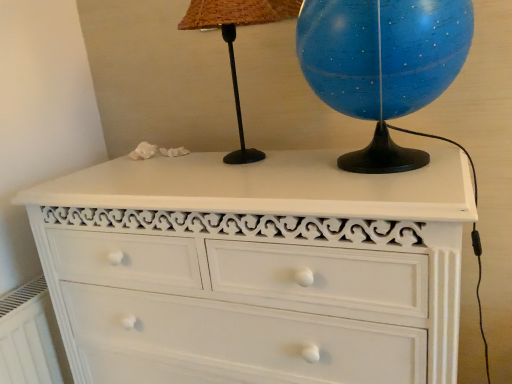
Where is `free spot to the left of black matte table lamp at upper center`? free spot to the left of black matte table lamp at upper center is located at coordinates (160, 160).